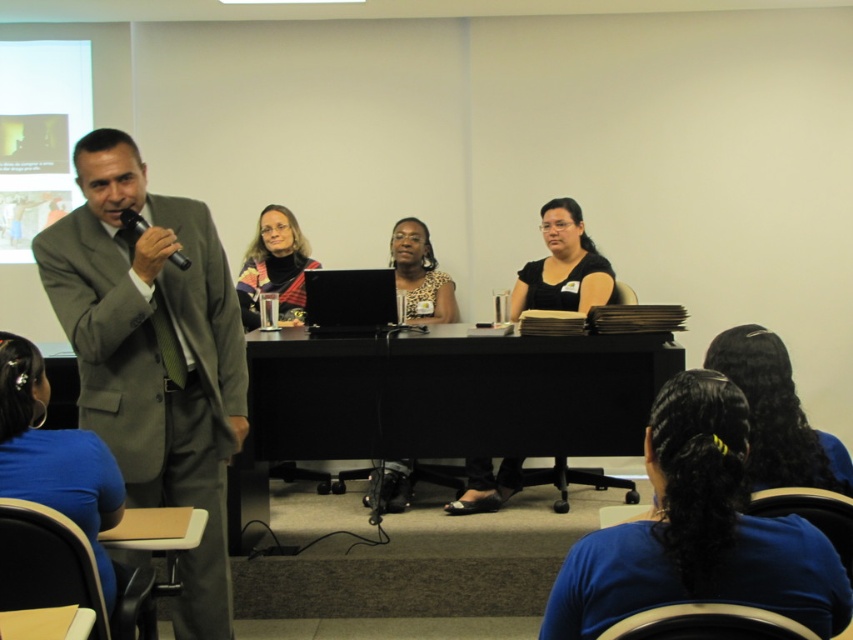
Question: Can you confirm if blue fabric shirt at lower left is bigger than leopard print blouse at center?

Choices:
 (A) no
 (B) yes

Answer: (A)

Question: Which object is closer to the camera taking this photo?

Choices:
 (A) black matte shirt at center
 (B) leopard print blouse at center

Answer: (A)

Question: In this image, where is gray suit at left located relative to leopard print blouse at center?

Choices:
 (A) left
 (B) right

Answer: (A)

Question: Among these objects, which one is farthest from the camera?

Choices:
 (A) black hair at lower right
 (B) blue fabric hair tie at lower right
 (C) leopard print blouse at center

Answer: (C)

Question: Which of the following is the closest to the observer?

Choices:
 (A) black hair at lower right
 (B) blue fabric hair tie at lower right
 (C) plaid fabric scarf at center
 (D) blue fabric shirt at lower left

Answer: (B)

Question: Can you confirm if black hair at lower right is positioned above black matte shirt at center?

Choices:
 (A) yes
 (B) no

Answer: (B)